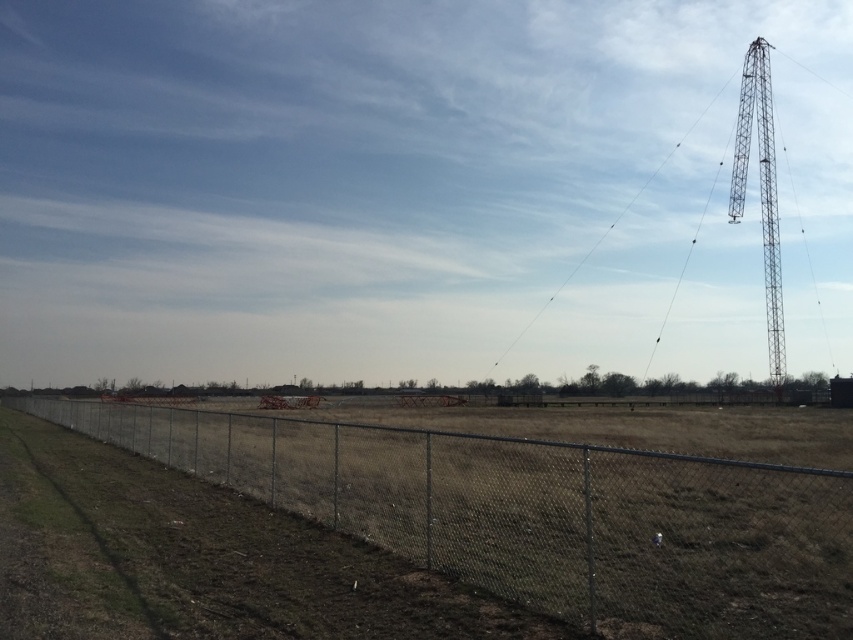
Can you confirm if metal chain-link fence at lower left is positioned to the left of metallic lattice tower at right?

Correct, you'll find metal chain-link fence at lower left to the left of metallic lattice tower at right.

Between point (670, 461) and point (764, 100), which one is positioned in front?

Point (670, 461) is in front.

Identify the location of metal chain-link fence at lower left. (537, 515).

Is metal chain-link fence at lower left below metallic wire at upper right?

Yes, metal chain-link fence at lower left is below metallic wire at upper right.

Can you confirm if metal chain-link fence at lower left is shorter than metallic wire at upper right?

Correct, metal chain-link fence at lower left is not as tall as metallic wire at upper right.

Between point (347, 458) and point (554, 298), which one is positioned in front?

Point (347, 458)

Identify the location of metal chain-link fence at lower left. This screenshot has width=853, height=640. (537, 515).

Who is shorter, metallic lattice tower at right or metallic wire at upper right?

metallic lattice tower at right is shorter.

Consider the image. Which is more to the right, metallic lattice tower at right or metallic wire at upper right?

metallic lattice tower at right

Based on the photo, who is more forward, (747, 138) or (728, 76)?

Point (747, 138) is in front.

You are a GUI agent. You are given a task and a screenshot of the screen. Output one action in this format:
    pyautogui.click(x=<x>, y=<y>)
    Task: Click on the metallic lattice tower at right
    This screenshot has height=640, width=853.
    Given the screenshot: What is the action you would take?
    pyautogui.click(x=759, y=192)